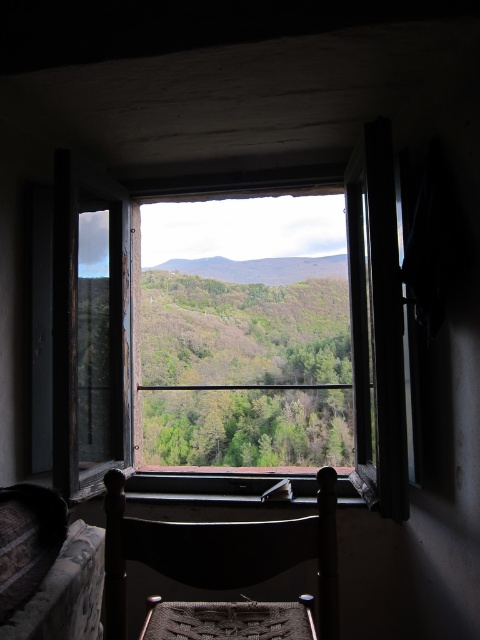
Question: Where is wooden window at center located in relation to green leafy mountain at center in the image?

Choices:
 (A) right
 (B) left

Answer: (A)

Question: Which is nearer to the green leafy mountain at center?

Choices:
 (A) dark wood chair at center
 (B) wooden window at center

Answer: (B)

Question: Can you confirm if dark wood chair at center is bigger than green leafy mountain at center?

Choices:
 (A) no
 (B) yes

Answer: (B)

Question: Is wooden window at center to the right of dark wood chair at center from the viewer's perspective?

Choices:
 (A) yes
 (B) no

Answer: (A)

Question: Which point is closer to the camera?

Choices:
 (A) dark wood chair at center
 (B) wooden window at center
 (C) green leafy mountain at center

Answer: (A)

Question: Which object is positioned farthest from the wooden window at center?

Choices:
 (A) green leafy mountain at center
 (B) dark wood chair at center

Answer: (B)